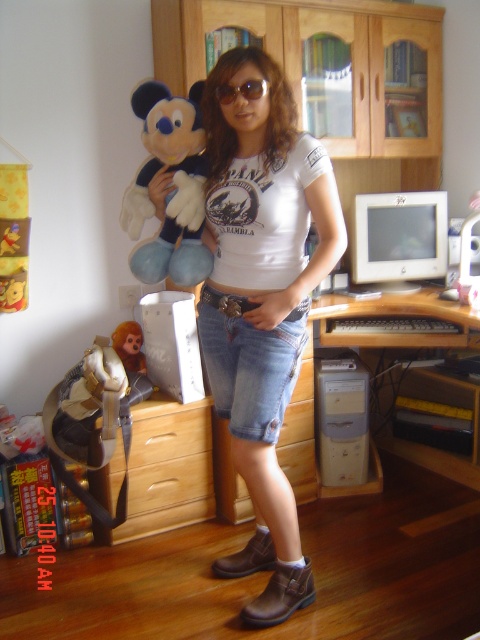
Does point (424, 28) lie behind point (254, 96)?

Yes, point (424, 28) is behind point (254, 96).

Who is positioned more to the left, wooden dresser at center or gold metallic sunglasses at center?

gold metallic sunglasses at center is more to the left.

Is point (370, 38) farther from camera compared to point (267, 86)?

Yes, it is.

You are a GUI agent. You are given a task and a screenshot of the screen. Output one action in this format:
    pyautogui.click(x=<x>, y=<y>)
    Task: Click on the wooden dresser at center
    
    Given the screenshot: What is the action you would take?
    pyautogui.click(x=300, y=54)

Who is more forward, (254,122) or (200,516)?

Point (254,122) is more forward.

Is white matte t-shirt at center positioned at the back of wooden at left?

No, white matte t-shirt at center is closer to the viewer.

Does point (223, 77) come in front of point (145, 488)?

Yes, it is in front of point (145, 488).

At what (x,y) coordinates should I click in order to perform the action: click on white matte t-shirt at center. Please return your answer as a coordinate pair (x, y). The height and width of the screenshot is (640, 480). Looking at the image, I should click on (263, 304).

Does point (280, 316) lie in front of point (262, 92)?

No.

Which is below, white matte t-shirt at center or gold metallic sunglasses at center?

white matte t-shirt at center

Who is more distant from viewer, (272, 580) or (261, 81)?

Point (272, 580)

At what (x,y) coordinates should I click in order to perform the action: click on white matte t-shirt at center. Please return your answer as a coordinate pair (x, y). Image resolution: width=480 pixels, height=640 pixels. Looking at the image, I should click on (263, 304).